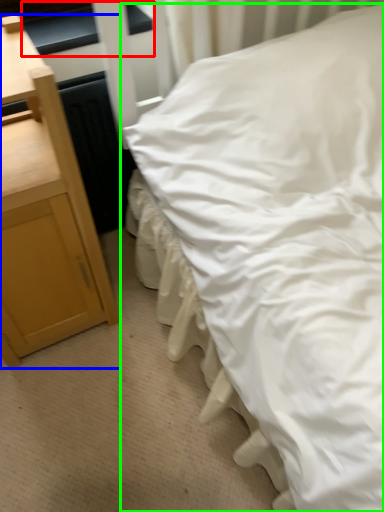
Question: Which object is positioned closest to window sill (highlighted by a red box)? Select from nightstand (highlighted by a blue box) and bed (highlighted by a green box).

Choices:
 (A) nightstand
 (B) bed

Answer: (A)